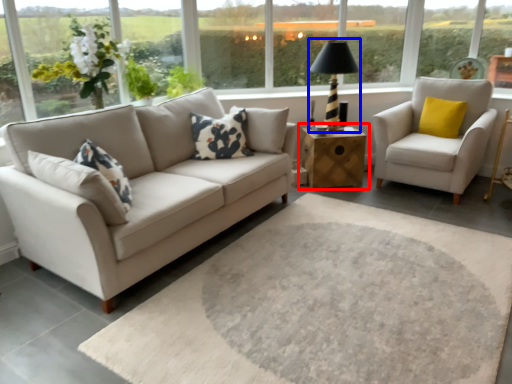
Question: Which of the following is the closest to the observer, table (highlighted by a red box) or table lamp (highlighted by a blue box)?

Choices:
 (A) table
 (B) table lamp

Answer: (B)